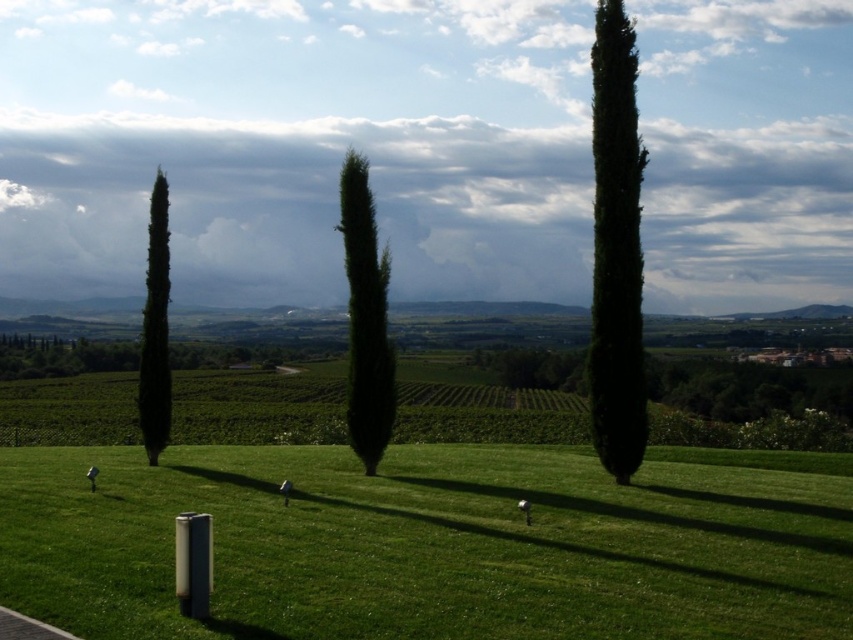
You are standing at the center of the image and want to walk towards the green grassy field at center. In which direction should you go?

The green grassy field at center is located at point coordinates of 0.853 on the x axis and 0.502 on the y axis. Since you are at the center of the image, which is point coordinates of 0.5 on both axes, you should move towards the right direction to reach the green grassy field at center.

You are standing at the point labeled point [65,490] and want to walk to the point labeled point [595,285]. Based on the landscape described, which direction should you head to ensure you are moving towards the destination?

You should head away from the cypress trees and towards the vineyard fields in the midground, as point [595,285] is further back in the scene compared to point [65,490] which is closer to the viewer.